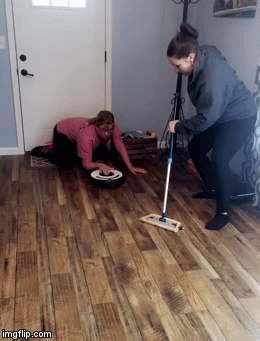
Identify the location of black door handle. The width and height of the screenshot is (260, 341). point(26,71).